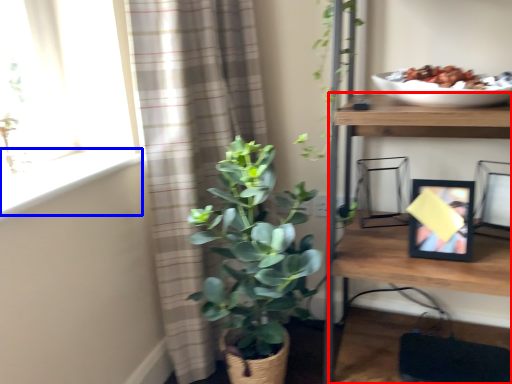
Question: Which object is further to the camera taking this photo, shelf (highlighted by a red box) or window sill (highlighted by a blue box)?

Choices:
 (A) shelf
 (B) window sill

Answer: (B)